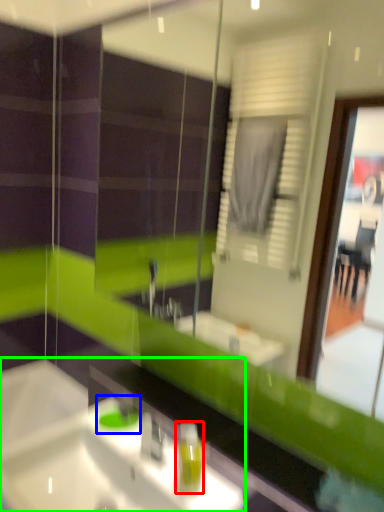
Question: Which object is the farthest from soap dispenser (highlighted by a red box)? Choose among these: teal (highlighted by a blue box) or sink (highlighted by a green box).

Choices:
 (A) teal
 (B) sink

Answer: (A)